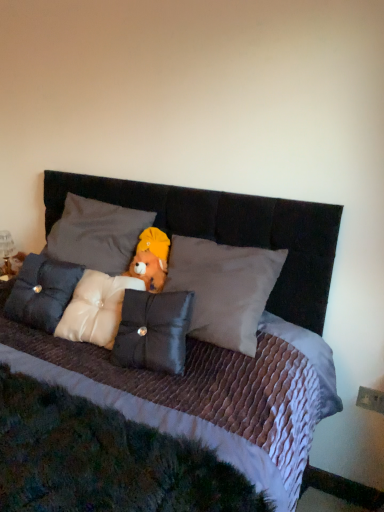
Question: Considering the relative sizes of satin black pillow at center, which ranks as the first pillow in right-to-left order, and metallic gold figurine at left in the image provided, is satin black pillow at center, which ranks as the first pillow in right-to-left order, taller than metallic gold figurine at left?

Choices:
 (A) no
 (B) yes

Answer: (B)

Question: Is satin black pillow at center, which ranks as the first pillow in right-to-left order, positioned beyond the bounds of metallic gold figurine at left?

Choices:
 (A) no
 (B) yes

Answer: (B)

Question: Considering the relative sizes of satin black pillow at center, arranged as the 4th pillow when viewed from the left, and metallic gold figurine at left in the image provided, is satin black pillow at center, arranged as the 4th pillow when viewed from the left, wider than metallic gold figurine at left?

Choices:
 (A) yes
 (B) no

Answer: (A)

Question: Considering the relative positions of satin black pillow at center, arranged as the 4th pillow when viewed from the left, and metallic gold figurine at left in the image provided, is satin black pillow at center, arranged as the 4th pillow when viewed from the left, behind metallic gold figurine at left?

Choices:
 (A) yes
 (B) no

Answer: (B)

Question: Is satin black pillow at center, which ranks as the first pillow in right-to-left order, positioned in front of metallic gold figurine at left?

Choices:
 (A) no
 (B) yes

Answer: (B)

Question: Does satin black pillow at center, arranged as the 4th pillow when viewed from the left, have a larger size compared to metallic gold figurine at left?

Choices:
 (A) no
 (B) yes

Answer: (B)

Question: Considering the relative sizes of white satin pillow at center, the 3th pillow from the right, and satin cushion at center, marked as the first pillow in a left-to-right arrangement, in the image provided, is white satin pillow at center, the 3th pillow from the right, smaller than satin cushion at center, marked as the first pillow in a left-to-right arrangement,?

Choices:
 (A) no
 (B) yes

Answer: (A)

Question: Does white satin pillow at center, placed as the second pillow when sorted from left to right, have a lesser width compared to satin cushion at center, which ranks as the 4th pillow in right-to-left order?

Choices:
 (A) yes
 (B) no

Answer: (B)

Question: Is white satin pillow at center, placed as the second pillow when sorted from left to right, oriented towards satin cushion at center, marked as the first pillow in a left-to-right arrangement?

Choices:
 (A) no
 (B) yes

Answer: (A)

Question: Does white satin pillow at center, the 3th pillow from the right, touch satin cushion at center, marked as the first pillow in a left-to-right arrangement?

Choices:
 (A) no
 (B) yes

Answer: (A)

Question: From a real-world perspective, is white satin pillow at center, placed as the second pillow when sorted from left to right, below satin cushion at center, marked as the first pillow in a left-to-right arrangement?

Choices:
 (A) yes
 (B) no

Answer: (B)

Question: Is white satin pillow at center, the 3th pillow from the right, to the left of satin cushion at center, which ranks as the 4th pillow in right-to-left order, from the viewer's perspective?

Choices:
 (A) yes
 (B) no

Answer: (B)

Question: Is satin cushion at center, marked as the first pillow in a left-to-right arrangement, to the right of white satin pillow at center, the 3th pillow from the right, from the viewer's perspective?

Choices:
 (A) no
 (B) yes

Answer: (A)